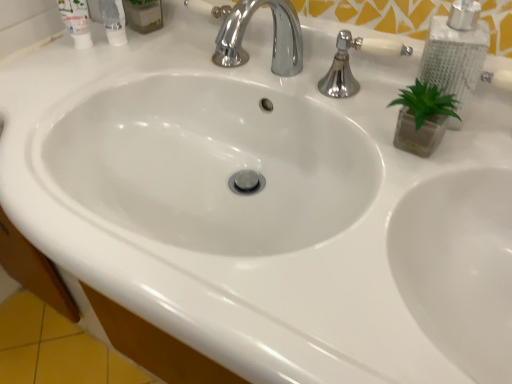
Image resolution: width=512 pixels, height=384 pixels. Identify the location of vacant area to the left of polished chrome faucet at upper center. (280, 90).